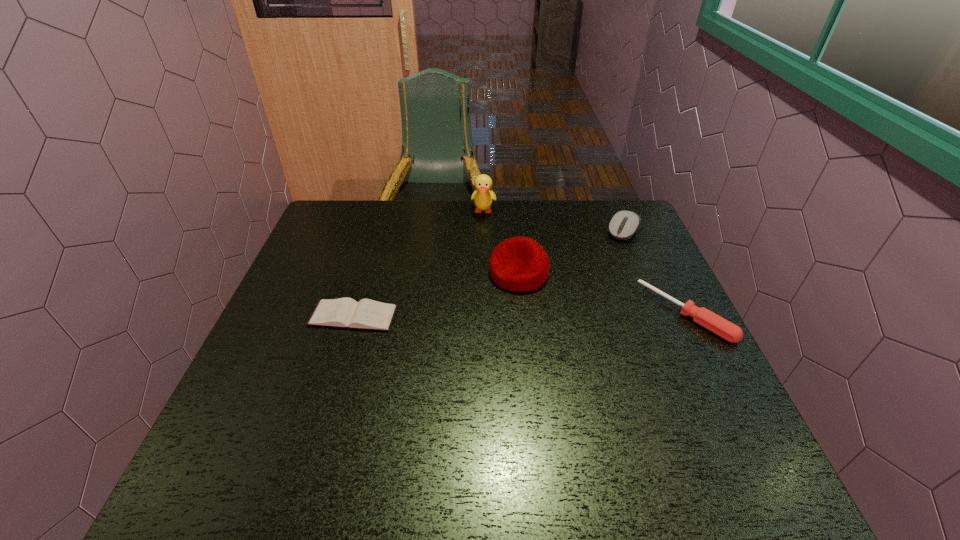
Find the location of a particular element. The width and height of the screenshot is (960, 540). screwdriver that is at the right edge is located at coordinates (725, 329).

Locate an element on the screen. The height and width of the screenshot is (540, 960). computer equipment present at the right edge is located at coordinates (623, 225).

Locate an element on the screen. The height and width of the screenshot is (540, 960). object that is at the far right corner is located at coordinates (623, 225).

Where is `free space at the far edge of the desktop`? The image size is (960, 540). free space at the far edge of the desktop is located at coordinates (545, 233).

The width and height of the screenshot is (960, 540). I want to click on vacant space at the near edge of the desktop, so click(623, 405).

Where is `vacant space at the left edge`? The image size is (960, 540). vacant space at the left edge is located at coordinates (319, 273).

Find the location of `free space at the right edge of the desktop`. free space at the right edge of the desktop is located at coordinates (684, 379).

In order to click on vacant space at the far left corner of the desktop in this screenshot , I will do `click(349, 235)`.

Locate an element on the screen. The height and width of the screenshot is (540, 960). vacant space at the near left corner of the desktop is located at coordinates (220, 425).

This screenshot has height=540, width=960. In order to click on blank area at the far right corner in this screenshot , I will do `click(601, 207)`.